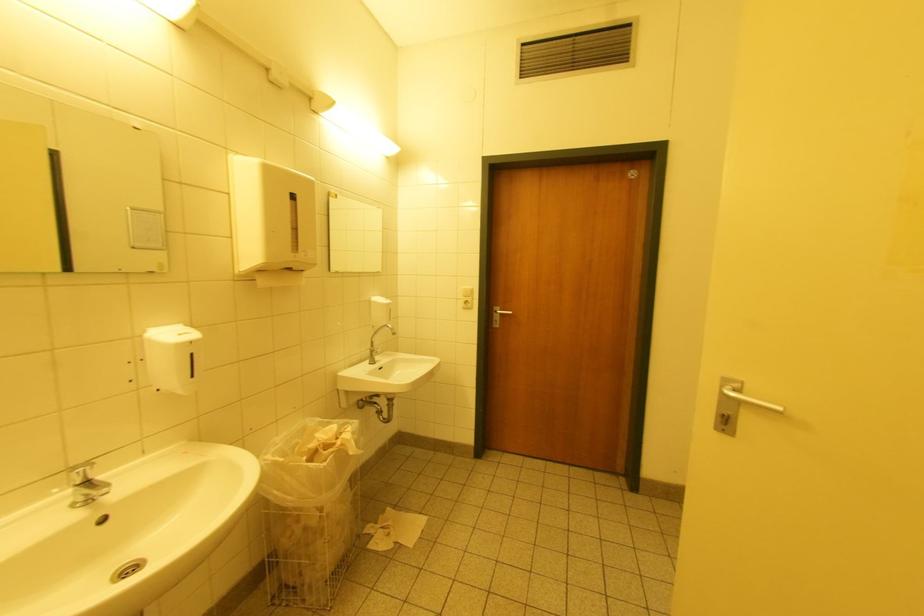
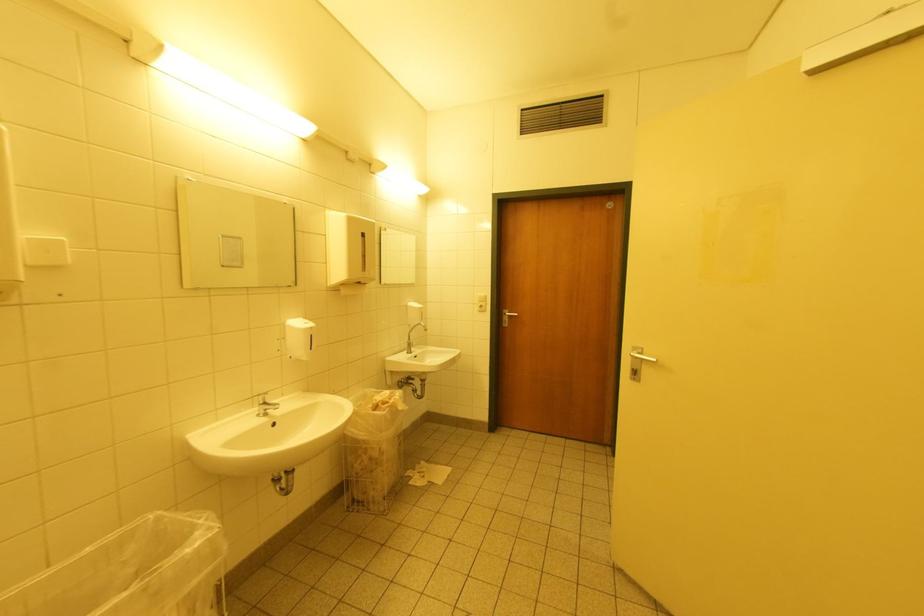
Question: Which direction would the cameraman need to move to produce the second image? Reply with the corresponding letter.

Choices:
 (A) Left
 (B) Right
 (C) Forward
 (D) Backward

Answer: (D)